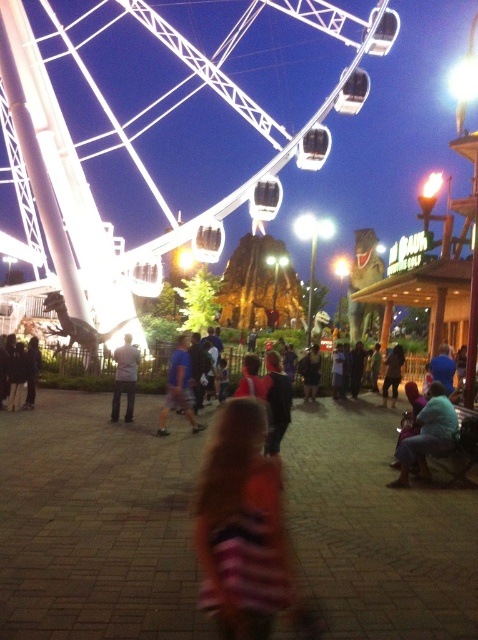
Question: Is white metallic ferris wheel at upper left thinner than blue denim jeans at lower right?

Choices:
 (A) yes
 (B) no

Answer: (B)

Question: Is white metallic ferris wheel at upper left smaller than striped shirt at center?

Choices:
 (A) no
 (B) yes

Answer: (A)

Question: Which of these objects is positioned farthest from the striped shirt at center?

Choices:
 (A) striped fabric dress at center
 (B) gray fabric pants at center

Answer: (A)

Question: Based on their relative distances, which object is farther from the striped shirt at center?

Choices:
 (A) blue denim jeans at lower right
 (B) striped fabric dress at center
 (C) gray fabric pants at center
 (D) blue striped shirt at center

Answer: (B)

Question: Considering the relative positions of striped fabric dress at center and striped shirt at center in the image provided, where is striped fabric dress at center located with respect to striped shirt at center?

Choices:
 (A) above
 (B) below

Answer: (B)

Question: Which point is closer to the camera?

Choices:
 (A) blue striped shirt at center
 (B) striped shirt at center
 (C) striped fabric dress at center
 (D) gray fabric pants at center

Answer: (C)